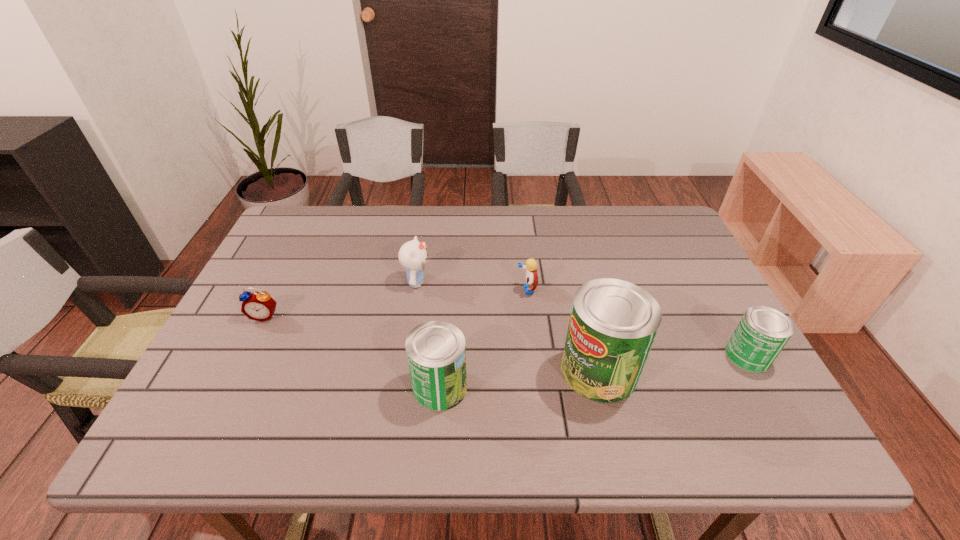
The height and width of the screenshot is (540, 960). Find the location of `the leftmost can`. the leftmost can is located at coordinates (436, 351).

The width and height of the screenshot is (960, 540). I want to click on the tallest object, so click(x=613, y=323).

This screenshot has width=960, height=540. I want to click on the tallest can, so click(x=613, y=323).

The image size is (960, 540). Identify the location of the rightmost can. (761, 334).

The image size is (960, 540). What are the coordinates of `the rightmost object` in the screenshot? It's located at (761, 334).

The height and width of the screenshot is (540, 960). What are the coordinates of `Lego` in the screenshot? It's located at (531, 283).

Locate an element on the screen. the third farthest object is located at coordinates (259, 306).

Where is `alarm clock`? The height and width of the screenshot is (540, 960). alarm clock is located at coordinates (259, 306).

Identify the location of kitten. (412, 255).

I want to click on vacant space located 0.100m on the right of the second tallest can, so click(x=513, y=387).